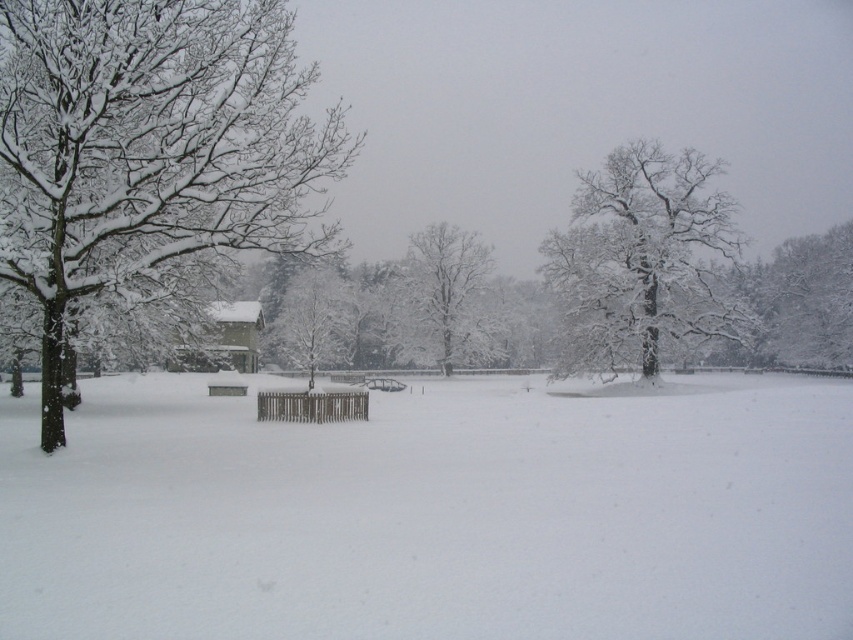
Is point (120, 449) closer to viewer compared to point (227, 129)?

No, it is behind (227, 129).

Does white fluffy snow at center lie behind snow-covered tree at left?

That is False.

This screenshot has width=853, height=640. I want to click on white fluffy snow at center, so click(x=433, y=515).

This screenshot has height=640, width=853. I want to click on white fluffy snow at center, so click(433, 515).

Who is shorter, snow-covered branches at center or snow-covered tree at center?

snow-covered tree at center is shorter.

Is snow-covered branches at center further to the viewer compared to snow-covered tree at center?

No, it is in front of snow-covered tree at center.

Is point (584, 300) behind point (416, 250)?

No.

I want to click on snow-covered branches at center, so click(641, 259).

Does point (318, 209) lie behind point (462, 266)?

Yes.

Between snow-covered tree at left and snow-covered tree at center, which one is positioned higher?

snow-covered tree at left is above.

Who is more forward, [120,150] or [463,316]?

Point [120,150] is in front.

The height and width of the screenshot is (640, 853). In order to click on snow-covered tree at left in this screenshot , I will do `click(149, 147)`.